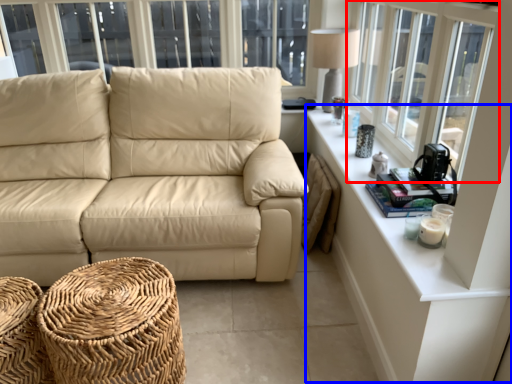
Question: Which object is closer to the camera taking this photo, window (highlighted by a red box) or table (highlighted by a blue box)?

Choices:
 (A) window
 (B) table

Answer: (A)